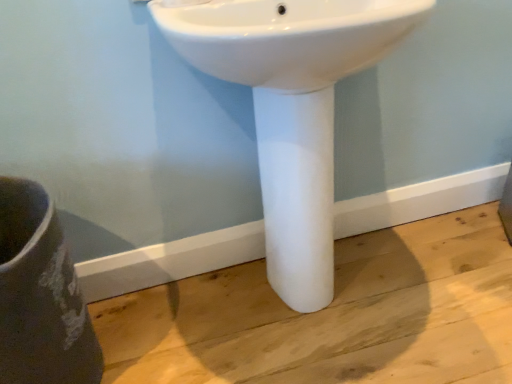
Question: Is matte gray vase at lower left bigger or smaller than white glossy sink at center?

Choices:
 (A) small
 (B) big

Answer: (A)

Question: Is matte gray vase at lower left taller or shorter than white glossy sink at center?

Choices:
 (A) tall
 (B) short

Answer: (B)

Question: From a real-world perspective, is matte gray vase at lower left above or below white glossy sink at center?

Choices:
 (A) below
 (B) above

Answer: (A)

Question: In the image, is white glossy sink at center positioned in front of or behind matte gray vase at lower left?

Choices:
 (A) behind
 (B) front

Answer: (B)

Question: Would you say white glossy sink at center is inside or outside matte gray vase at lower left?

Choices:
 (A) inside
 (B) outside

Answer: (B)

Question: Considering the positions of white glossy sink at center and matte gray vase at lower left in the image, is white glossy sink at center wider or thinner than matte gray vase at lower left?

Choices:
 (A) wide
 (B) thin

Answer: (B)

Question: From a real-world perspective, is white glossy sink at center physically located above or below matte gray vase at lower left?

Choices:
 (A) below
 (B) above

Answer: (B)